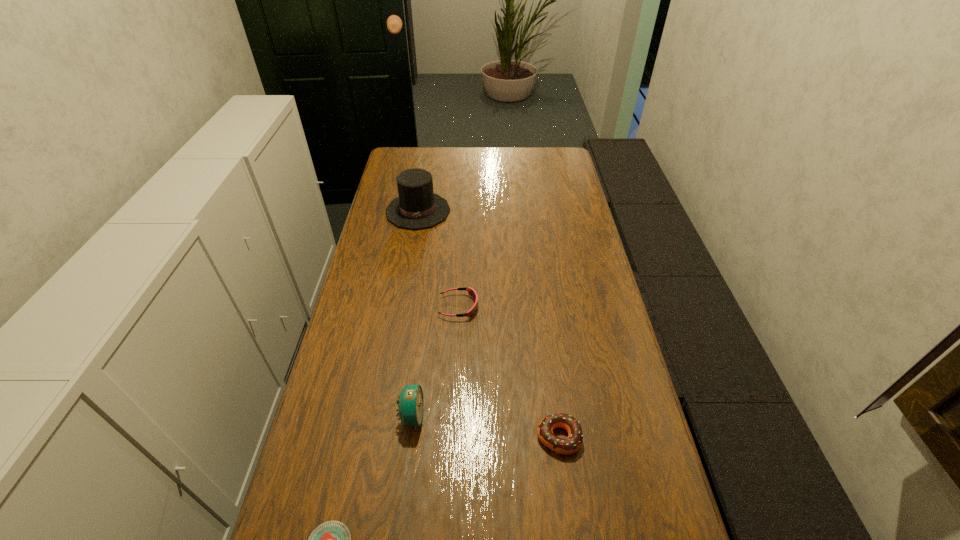
Identify the location of free space that satisfies the following two spatial constraints: 1. on the back side of the rightmost object; 2. on the front-facing side of the fourth shortest object. (556, 416).